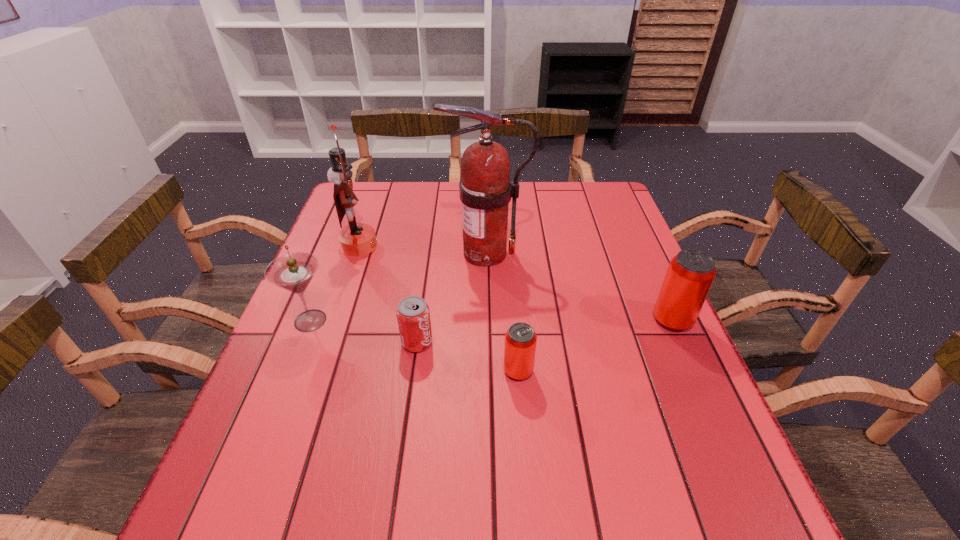
Please point a spot to add another can on the left. Please provide its 2D coordinates. Your answer should be formatted as a tuple, i.e. [(x, y)], where the tuple contains the x and y coordinates of a point satisfying the conditions above.

[(323, 435)]